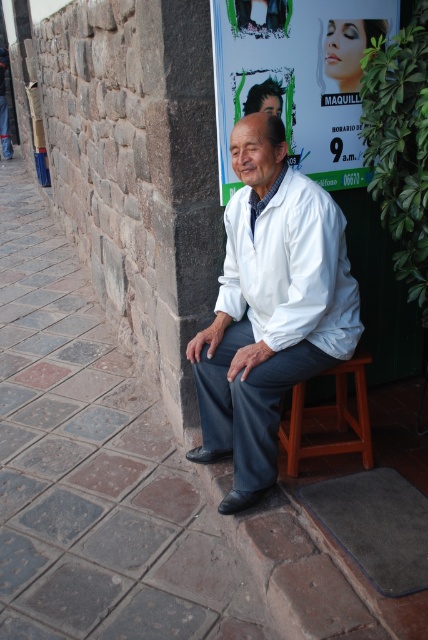
Question: From the image, what is the correct spatial relationship of white smooth coat at center in relation to matte white poster at upper center?

Choices:
 (A) above
 (B) below

Answer: (B)

Question: Does matte white poster at upper center appear over brown wooden stool at lower center?

Choices:
 (A) no
 (B) yes

Answer: (B)

Question: Among these points, which one is farthest from the camera?

Choices:
 (A) (369, 449)
 (B) (231, 198)
 (C) (318, 355)
 (D) (231, 45)

Answer: (A)

Question: Which object appears farthest from the camera in this image?

Choices:
 (A) white smooth dress shirt at center
 (B) white smooth coat at center

Answer: (B)

Question: Which object appears farthest from the camera in this image?

Choices:
 (A) white smooth coat at center
 (B) matte white poster at upper center

Answer: (B)

Question: Is white smooth coat at center closer to the viewer compared to white smooth dress shirt at center?

Choices:
 (A) no
 (B) yes

Answer: (A)